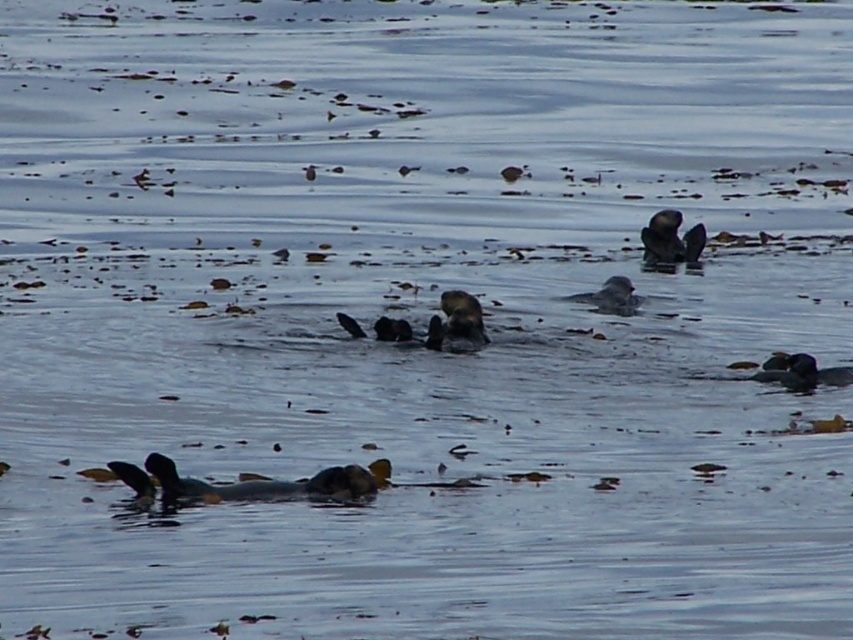
Who is more distant from viewer, (479, 339) or (798, 387)?

Point (479, 339)

Does point (436, 344) come behind point (769, 378)?

Yes.

Is point (465, 292) closer to viewer compared to point (790, 362)?

No.

The height and width of the screenshot is (640, 853). In order to click on brown fuzzy otter at center in this screenshot , I will do `click(457, 323)`.

Can you confirm if brown fuzzy otter at center is shorter than gray matte duck at center?

In fact, brown fuzzy otter at center may be taller than gray matte duck at center.

Is brown fuzzy otter at center positioned in front of gray matte duck at center?

That is True.

Looking at this image, who is more forward, (x=473, y=336) or (x=619, y=291)?

Point (x=473, y=336) is in front.

Where is `brown fuzzy otter at center`? This screenshot has width=853, height=640. brown fuzzy otter at center is located at coordinates (457, 323).

In the scene shown: Is dark gray fur duck at lower left wider than gray matte duck at center?

Correct, the width of dark gray fur duck at lower left exceeds that of gray matte duck at center.

Measure the distance between dark gray fur duck at lower left and gray matte duck at center.

dark gray fur duck at lower left and gray matte duck at center are 9.55 feet apart from each other.

Is point (334, 493) positioned after point (616, 308)?

No, it is not.

Locate an element on the screen. This screenshot has height=640, width=853. dark gray fur duck at lower left is located at coordinates (241, 483).